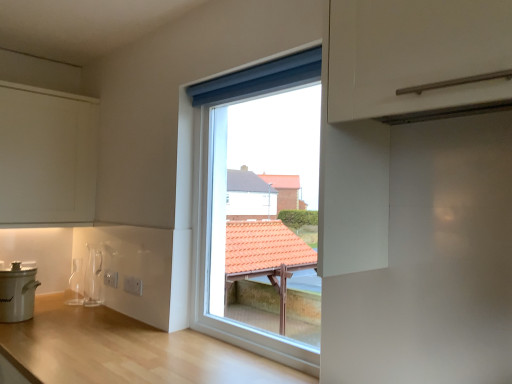
Question: Considering the relative positions of white matte cooker at lower left and white matte cabinet at upper left in the image provided, is white matte cooker at lower left behind white matte cabinet at upper left?

Choices:
 (A) yes
 (B) no

Answer: (B)

Question: From a real-world perspective, does white matte cooker at lower left stand above white matte cabinet at upper left?

Choices:
 (A) yes
 (B) no

Answer: (B)

Question: Does white matte cooker at lower left have a lesser height compared to white matte cabinet at upper left?

Choices:
 (A) no
 (B) yes

Answer: (B)

Question: From the image's perspective, would you say white matte cooker at lower left is shown under white matte cabinet at upper left?

Choices:
 (A) yes
 (B) no

Answer: (A)

Question: Is white matte cooker at lower left positioned with its back to white matte cabinet at upper left?

Choices:
 (A) no
 (B) yes

Answer: (A)

Question: Is light wood countertop at center taller or shorter than white matte cabinet at upper left?

Choices:
 (A) short
 (B) tall

Answer: (A)

Question: From the image's perspective, is light wood countertop at center positioned above or below white matte cabinet at upper left?

Choices:
 (A) above
 (B) below

Answer: (B)

Question: Is light wood countertop at center in front of or behind white matte cabinet at upper left in the image?

Choices:
 (A) behind
 (B) front

Answer: (B)

Question: In terms of width, does light wood countertop at center look wider or thinner when compared to white matte cabinet at upper left?

Choices:
 (A) wide
 (B) thin

Answer: (A)

Question: From the image's perspective, relative to white matte cooker at lower left, is white matte cabinet at upper left above or below?

Choices:
 (A) below
 (B) above

Answer: (B)

Question: Is white matte cabinet at upper left taller or shorter than white matte cooker at lower left?

Choices:
 (A) tall
 (B) short

Answer: (A)

Question: Looking at their shapes, would you say white matte cabinet at upper left is wider or thinner than white matte cooker at lower left?

Choices:
 (A) thin
 (B) wide

Answer: (B)

Question: Does point (60, 107) appear closer or farther from the camera than point (27, 304)?

Choices:
 (A) farther
 (B) closer

Answer: (A)

Question: From the image's perspective, is white matte cooker at lower left positioned above or below white matte cabinet at upper left?

Choices:
 (A) below
 (B) above

Answer: (A)

Question: Considering the relative positions of white matte cooker at lower left and white matte cabinet at upper left in the image provided, is white matte cooker at lower left to the left or to the right of white matte cabinet at upper left?

Choices:
 (A) right
 (B) left

Answer: (A)